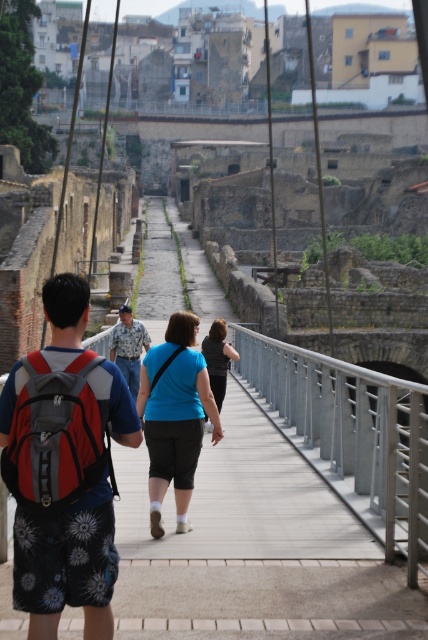
You are a visitor at the archaeological site and want to check your belongings. You see a red backpack at left and a red fabric backpack at center. Which backpack is closer to the ground?

The red backpack at left is positioned under the red fabric backpack at center, so it is closer to the ground.